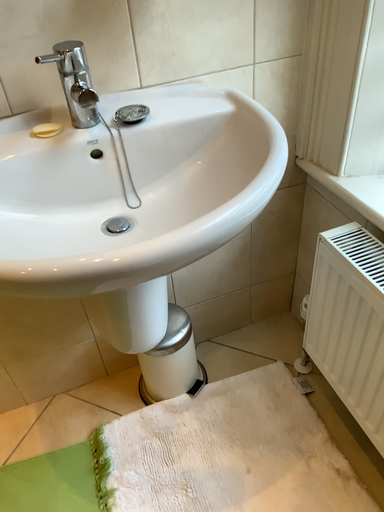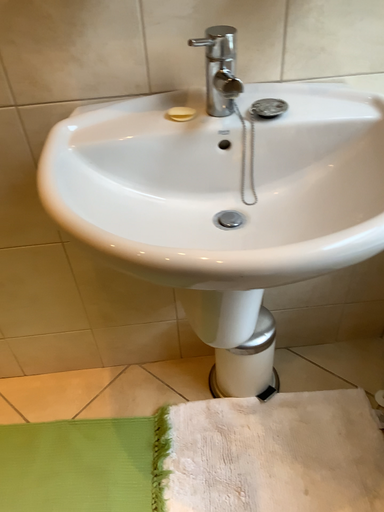
Question: How did the camera likely rotate when shooting the video?

Choices:
 (A) rotated right
 (B) rotated left

Answer: (B)